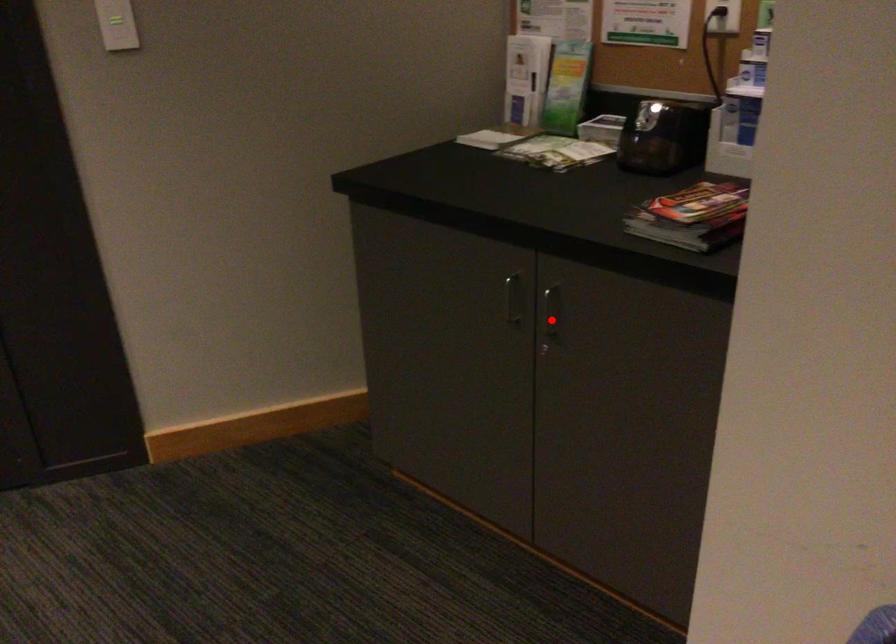
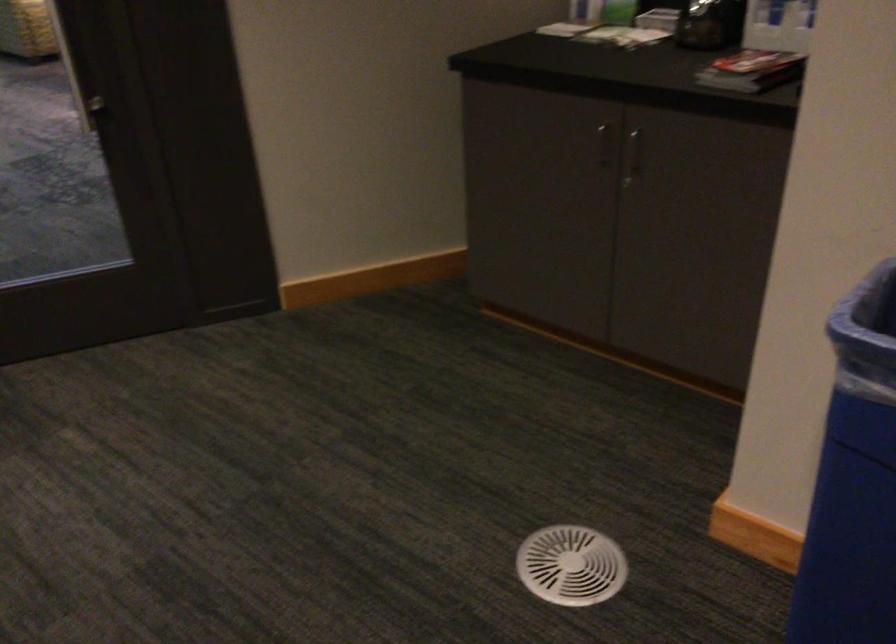
In the second image, find the point that corresponds to the highlighted location in the first image.

(633, 155)